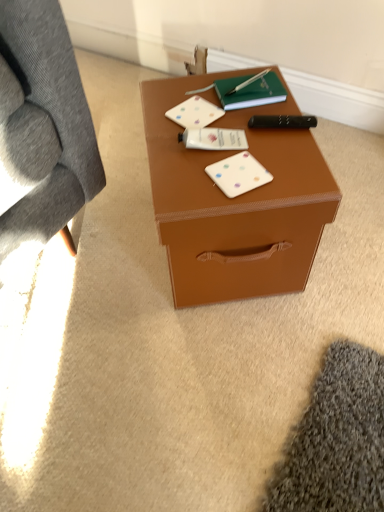
You are a GUI agent. You are given a task and a screenshot of the screen. Output one action in this format:
    pyautogui.click(x=<x>, y=<y>)
    Task: Click on the free space to the left of white matte card game at center, which is the 1th card game in bottom-to-top order
    This screenshot has height=512, width=384.
    Given the screenshot: What is the action you would take?
    pyautogui.click(x=179, y=177)